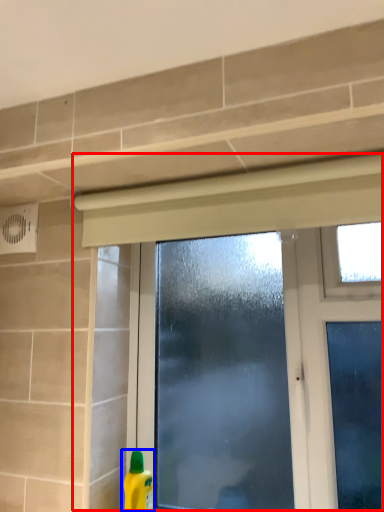
Question: Among these objects, which one is farthest to the camera, window (highlighted by a red box) or cleaning product (highlighted by a blue box)?

Choices:
 (A) window
 (B) cleaning product

Answer: (B)